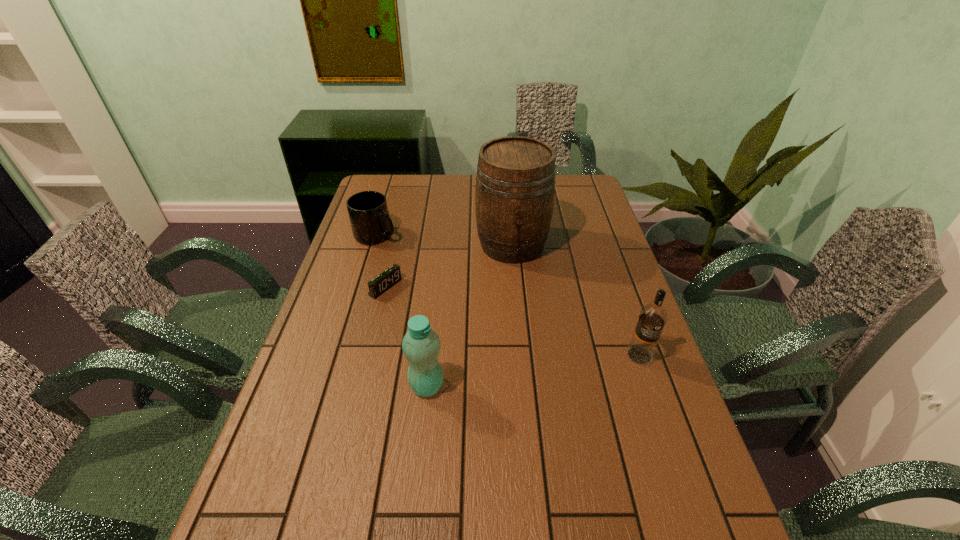
The width and height of the screenshot is (960, 540). Identify the location of mug that is at the left edge. click(x=369, y=217).

Where is `alarm clock at the left edge`? This screenshot has height=540, width=960. alarm clock at the left edge is located at coordinates (384, 281).

Identify the location of object at the right edge. (653, 316).

At what (x,y) coordinates should I click in order to perform the action: click on vacant space at the far edge of the desktop. Please return your answer as a coordinate pair (x, y). Looking at the image, I should click on (449, 175).

In the image, there is a desktop. Where is `vacant area at the left edge`? Image resolution: width=960 pixels, height=540 pixels. vacant area at the left edge is located at coordinates (276, 469).

Locate an element on the screen. The image size is (960, 540). vacant space at the right edge of the desktop is located at coordinates point(588,327).

In the image, there is a desktop. At what (x,y) coordinates should I click in order to perform the action: click on free region at the near left corner. Please return your answer as a coordinate pair (x, y). Image resolution: width=960 pixels, height=540 pixels. Looking at the image, I should click on (238, 517).

The image size is (960, 540). I want to click on vacant area that lies between the second shortest object and the third farthest object, so click(381, 261).

Image resolution: width=960 pixels, height=540 pixels. What are the coordinates of `free space between the rightmost object and the tallest object` in the screenshot? It's located at (576, 300).

This screenshot has width=960, height=540. Find the location of `vacant space in between the second object from right to left and the rightmost object`. vacant space in between the second object from right to left and the rightmost object is located at coordinates click(576, 300).